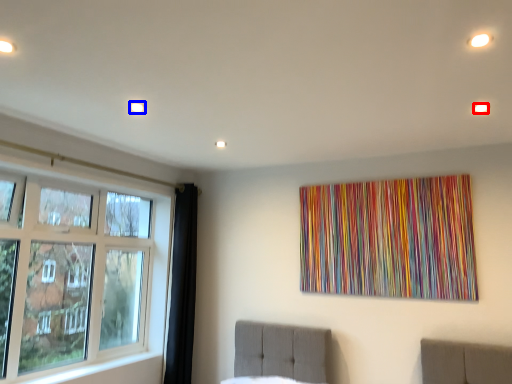
Question: Which of the following is the farthest to the observer, light (highlighted by a red box) or light (highlighted by a blue box)?

Choices:
 (A) light
 (B) light

Answer: (B)